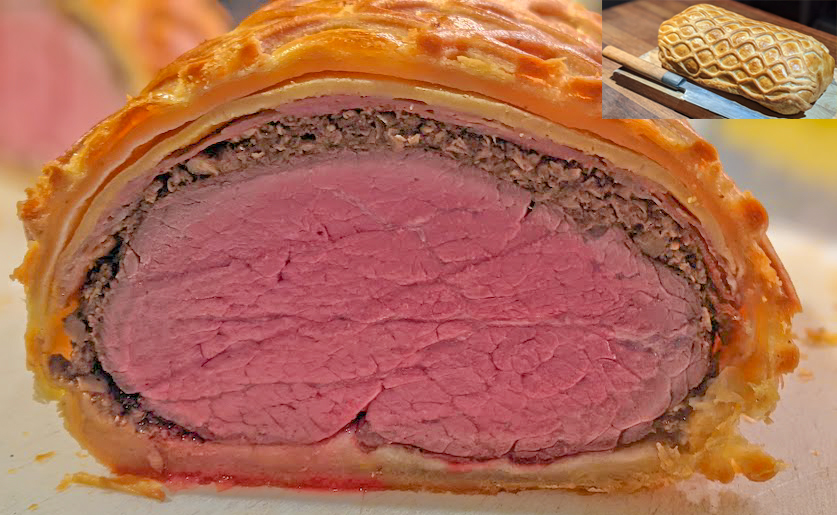
Identify the location of wooden table. (630, 26), (644, 107), (763, 14).